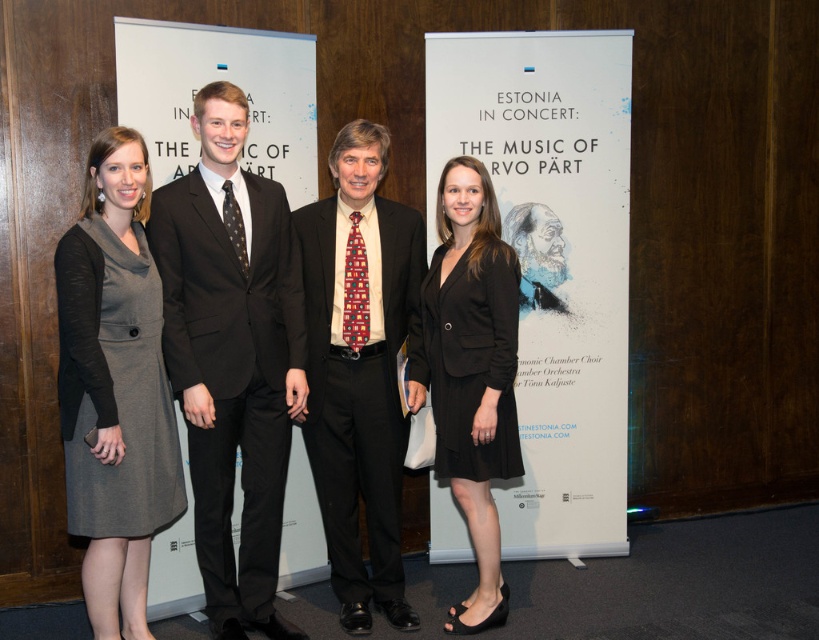
You are a photographer at a formal event. You notice the white paper at center and the black matte blazer at center. Which object is covering the other one?

The white paper at center is positioned over black matte blazer at center, so the white paper is covering the black matte blazer.

You are a photographer at the event. You need to adjust the lighting so that the white paper at center and the black dotted tie at center are evenly lit. Given that the current distance between them is 1.43 meters, what is the minimum distance your lighting equipment must cover to ensure both are illuminated adequately?

The minimum distance the lighting equipment must cover is 1.43 meters to ensure both the white paper at center and the black dotted tie at center are adequately illuminated.

You are standing in the same room as the four individuals in the image. You need to place a small gift box exactly where the white paper at center was located. According to the image, what coordinates should you aim for to place the gift box?

The coordinates for placing the gift box should be at point (551, 260), as the white paper at center was positioned there.